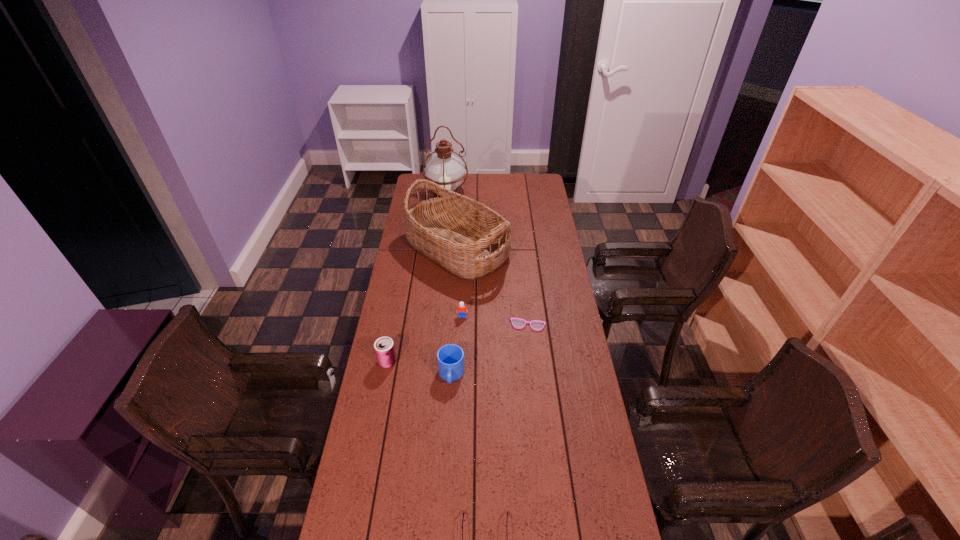
The width and height of the screenshot is (960, 540). I want to click on object that is at the right edge, so click(536, 325).

Locate an element on the screen. object that is at the far left corner is located at coordinates (444, 169).

The width and height of the screenshot is (960, 540). What are the coordinates of `free region at the far edge` in the screenshot? It's located at (x=465, y=187).

Find the location of a particular element. The width and height of the screenshot is (960, 540). vacant region at the left edge of the desktop is located at coordinates (420, 202).

This screenshot has width=960, height=540. In the image, there is a desktop. What are the coordinates of `vacant space at the right edge` in the screenshot? It's located at click(531, 200).

The image size is (960, 540). What are the coordinates of `vacant space at the far right corner of the desktop` in the screenshot? It's located at (535, 195).

The width and height of the screenshot is (960, 540). In order to click on vacant area that lies between the farther spectacles and the second farthest object in this screenshot , I will do `click(492, 287)`.

Find the location of `vacant space in between the taller spectacles and the second tallest object`. vacant space in between the taller spectacles and the second tallest object is located at coordinates (492, 287).

Where is `vacant area that lies between the sixth nearest object and the Lego`? The image size is (960, 540). vacant area that lies between the sixth nearest object and the Lego is located at coordinates (460, 282).

Where is `vacant space in between the mug and the can`? The image size is (960, 540). vacant space in between the mug and the can is located at coordinates (420, 368).